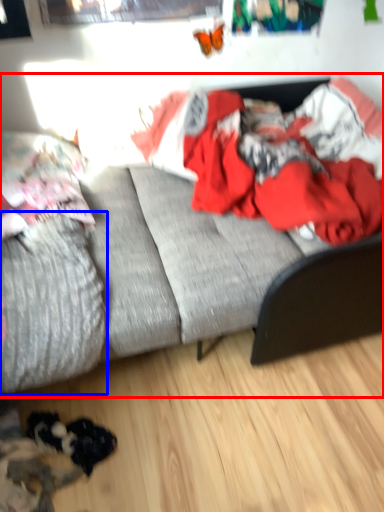
Question: Which object is closer to the camera taking this photo, studio couch (highlighted by a red box) or mattress (highlighted by a blue box)?

Choices:
 (A) studio couch
 (B) mattress

Answer: (A)